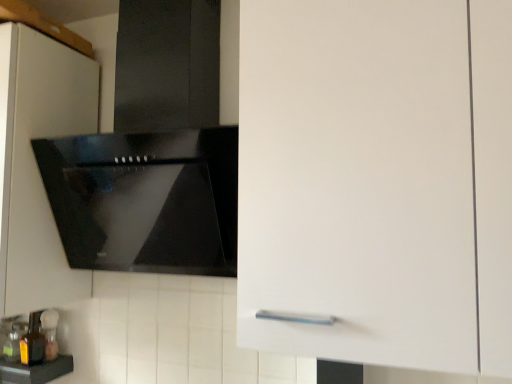
Question: From a real-world perspective, does black glossy countertop at lower left sit lower than translucent amber bottle at lower left, positioned as the second bottle in back-to-front order?

Choices:
 (A) no
 (B) yes

Answer: (B)

Question: Does black glossy countertop at lower left contain translucent amber bottle at lower left, positioned as the second bottle in back-to-front order?

Choices:
 (A) no
 (B) yes

Answer: (A)

Question: Considering the relative positions of black glossy countertop at lower left and translucent amber bottle at lower left, which appears as the 1th bottle when viewed from the front, in the image provided, is black glossy countertop at lower left to the right of translucent amber bottle at lower left, which appears as the 1th bottle when viewed from the front, from the viewer's perspective?

Choices:
 (A) no
 (B) yes

Answer: (A)

Question: Does black glossy countertop at lower left lie behind translucent amber bottle at lower left, positioned as the second bottle in back-to-front order?

Choices:
 (A) yes
 (B) no

Answer: (B)

Question: Is black glossy countertop at lower left looking in the opposite direction of translucent amber bottle at lower left, positioned as the second bottle in back-to-front order?

Choices:
 (A) no
 (B) yes

Answer: (A)

Question: Considering the relative sizes of black glossy countertop at lower left and translucent amber bottle at lower left, positioned as the second bottle in back-to-front order, in the image provided, is black glossy countertop at lower left wider than translucent amber bottle at lower left, positioned as the second bottle in back-to-front order,?

Choices:
 (A) yes
 (B) no

Answer: (A)

Question: Could translucent glass bottle at lower left, marked as the second bottle in a front-to-back arrangement, be considered to be inside translucent amber bottle at lower left, positioned as the second bottle in back-to-front order?

Choices:
 (A) no
 (B) yes

Answer: (A)

Question: Can you see translucent amber bottle at lower left, which appears as the 1th bottle when viewed from the front, touching translucent glass bottle at lower left, which ranks as the 1th bottle in back-to-front order?

Choices:
 (A) yes
 (B) no

Answer: (A)

Question: Is translucent amber bottle at lower left, positioned as the second bottle in back-to-front order, oriented towards translucent glass bottle at lower left, marked as the second bottle in a front-to-back arrangement?

Choices:
 (A) no
 (B) yes

Answer: (B)

Question: From a real-world perspective, is translucent amber bottle at lower left, which appears as the 1th bottle when viewed from the front, under translucent glass bottle at lower left, marked as the second bottle in a front-to-back arrangement?

Choices:
 (A) no
 (B) yes

Answer: (A)

Question: Can you confirm if translucent amber bottle at lower left, which appears as the 1th bottle when viewed from the front, is smaller than translucent glass bottle at lower left, which ranks as the 1th bottle in back-to-front order?

Choices:
 (A) no
 (B) yes

Answer: (A)

Question: Is translucent amber bottle at lower left, positioned as the second bottle in back-to-front order, closer to camera compared to translucent glass bottle at lower left, marked as the second bottle in a front-to-back arrangement?

Choices:
 (A) yes
 (B) no

Answer: (A)

Question: Does white matte cabinet at upper left have a lesser height compared to black glossy countertop at lower left?

Choices:
 (A) no
 (B) yes

Answer: (A)